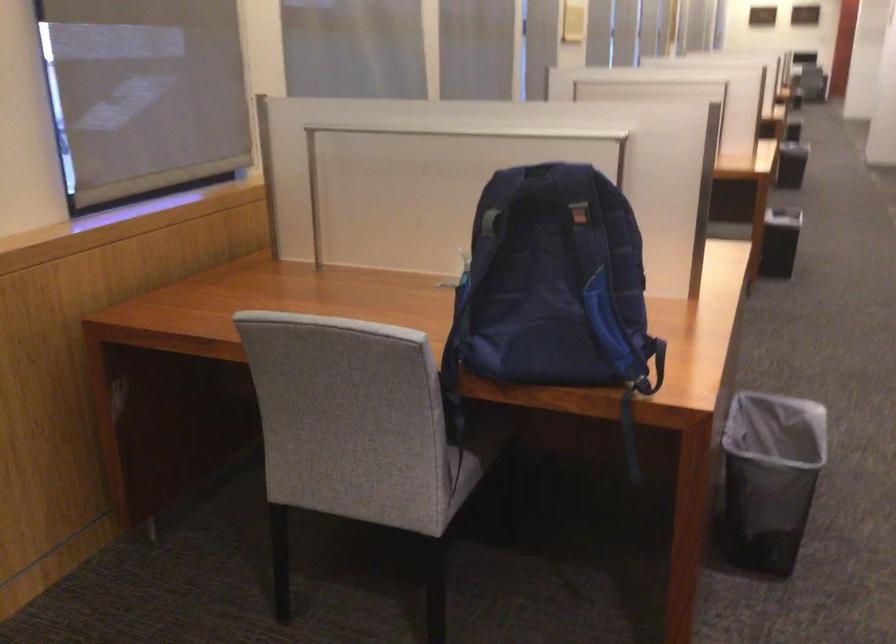
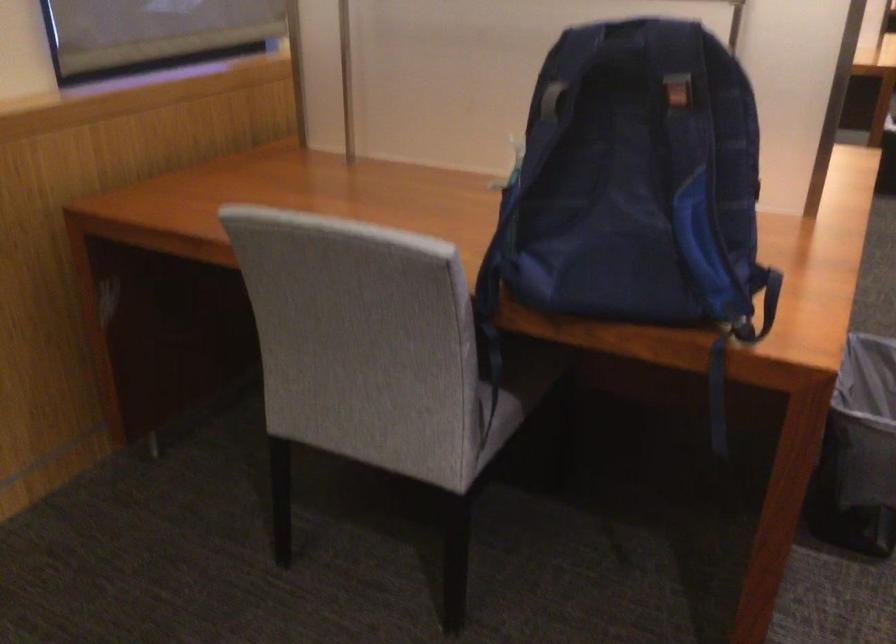
Find the pixel in the second image that matches point 487,222 in the first image.

(552, 100)